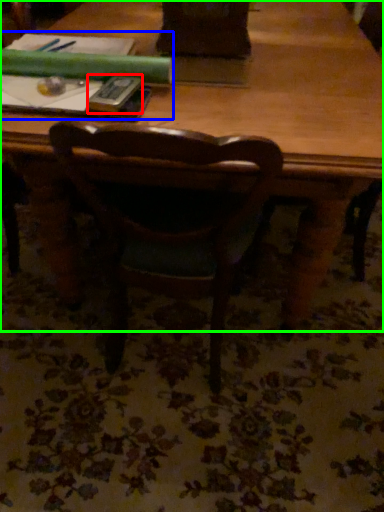
Question: Which object is the farthest from paperback book (highlighted by a red box)? Choose among these: book (highlighted by a blue box) or table (highlighted by a green box).

Choices:
 (A) book
 (B) table

Answer: (B)